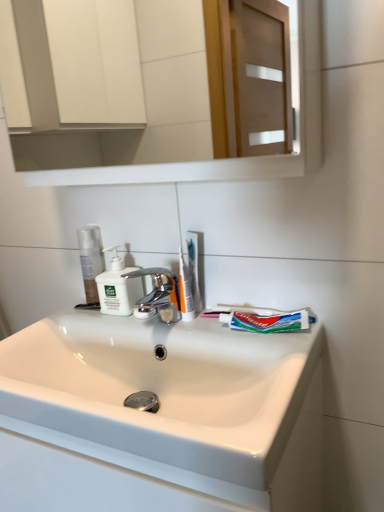
Where is `empty space that is in between white matte soap dispenser at center and chrome metallic faucet at center`? The image size is (384, 512). empty space that is in between white matte soap dispenser at center and chrome metallic faucet at center is located at coordinates (125, 318).